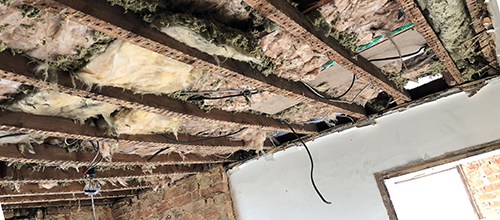
Identify the location of window. The image size is (500, 220). (435, 213), (486, 184).